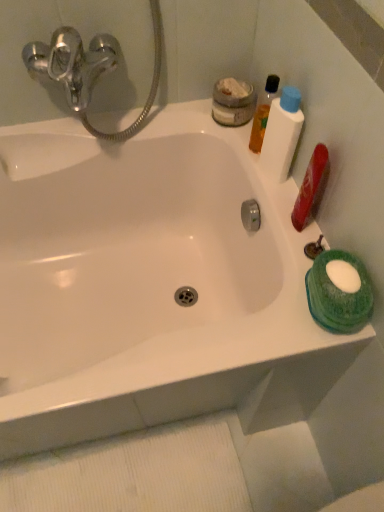
Question: Is green sponge at right, placed as the first mouthwash when sorted from bottom to top, positioned with its back to translucent orange liquid at upper right, the second mouthwash positioned from the top?

Choices:
 (A) yes
 (B) no

Answer: (B)

Question: Does green sponge at right, which appears as the 5th mouthwash when viewed from the top, have a lesser width compared to translucent orange liquid at upper right, the second mouthwash positioned from the top?

Choices:
 (A) no
 (B) yes

Answer: (A)

Question: Does green sponge at right, placed as the first mouthwash when sorted from bottom to top, have a greater height compared to translucent orange liquid at upper right, the second mouthwash positioned from the top?

Choices:
 (A) no
 (B) yes

Answer: (A)

Question: From a real-world perspective, is green sponge at right, placed as the first mouthwash when sorted from bottom to top, physically above translucent orange liquid at upper right, which is counted as the fourth mouthwash, starting from the bottom?

Choices:
 (A) yes
 (B) no

Answer: (B)

Question: Does green sponge at right, placed as the first mouthwash when sorted from bottom to top, have a larger size compared to translucent orange liquid at upper right, which is counted as the fourth mouthwash, starting from the bottom?

Choices:
 (A) no
 (B) yes

Answer: (B)

Question: From their relative heights in the image, would you say green sponge at right, which appears as the 5th mouthwash when viewed from the top, is taller or shorter than white plastic bottle at upper right, which appears as the 3th mouthwash when viewed from the top?

Choices:
 (A) short
 (B) tall

Answer: (A)

Question: Is green sponge at right, placed as the first mouthwash when sorted from bottom to top, wider or thinner than white plastic bottle at upper right, which appears as the 3th mouthwash when viewed from the top?

Choices:
 (A) thin
 (B) wide

Answer: (B)

Question: Which is correct: green sponge at right, which appears as the 5th mouthwash when viewed from the top, is inside white plastic bottle at upper right, which appears as the 3th mouthwash when viewed from the top, or outside of it?

Choices:
 (A) outside
 (B) inside

Answer: (A)

Question: Considering their positions, is green sponge at right, which appears as the 5th mouthwash when viewed from the top, located in front of or behind white plastic bottle at upper right, which appears as the 3th mouthwash when viewed from the top?

Choices:
 (A) behind
 (B) front

Answer: (B)

Question: From the image's perspective, is matte gray jar at upper right, placed as the fifth mouthwash when sorted from bottom to top, positioned above or below translucent orange liquid at upper right, the second mouthwash positioned from the top?

Choices:
 (A) above
 (B) below

Answer: (A)

Question: In terms of size, does matte gray jar at upper right, placed as the first mouthwash when sorted from top to bottom, appear bigger or smaller than translucent orange liquid at upper right, which is counted as the fourth mouthwash, starting from the bottom?

Choices:
 (A) big
 (B) small

Answer: (A)

Question: Looking at their shapes, would you say matte gray jar at upper right, placed as the first mouthwash when sorted from top to bottom, is wider or thinner than translucent orange liquid at upper right, which is counted as the fourth mouthwash, starting from the bottom?

Choices:
 (A) thin
 (B) wide

Answer: (B)

Question: Relative to translucent orange liquid at upper right, which is counted as the fourth mouthwash, starting from the bottom, is matte gray jar at upper right, placed as the first mouthwash when sorted from top to bottom, in front or behind?

Choices:
 (A) front
 (B) behind

Answer: (B)

Question: From the image's perspective, relative to matte gray jar at upper right, placed as the first mouthwash when sorted from top to bottom, is translucent orange liquid at upper right, which is counted as the fourth mouthwash, starting from the bottom, above or below?

Choices:
 (A) below
 (B) above

Answer: (A)

Question: From a real-world perspective, is translucent orange liquid at upper right, the second mouthwash positioned from the top, positioned above or below matte gray jar at upper right, placed as the first mouthwash when sorted from top to bottom?

Choices:
 (A) above
 (B) below

Answer: (A)